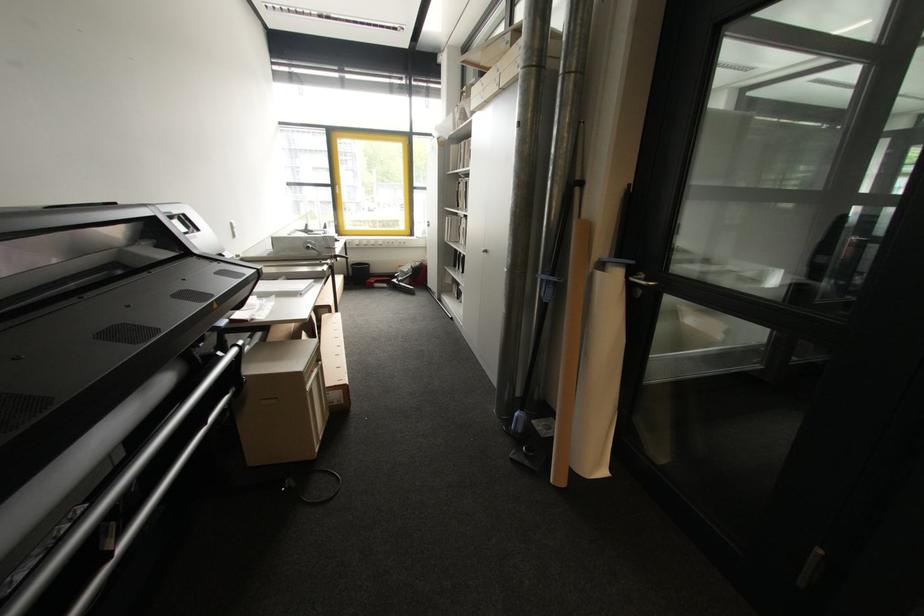
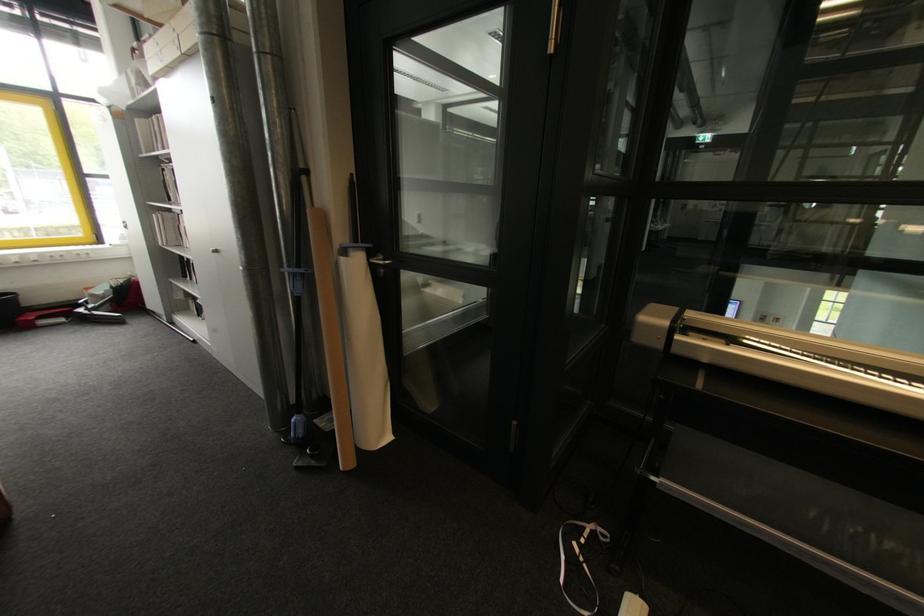
The point at (388, 286) is marked in the first image. Where is the corresponding point in the second image?

(66, 321)